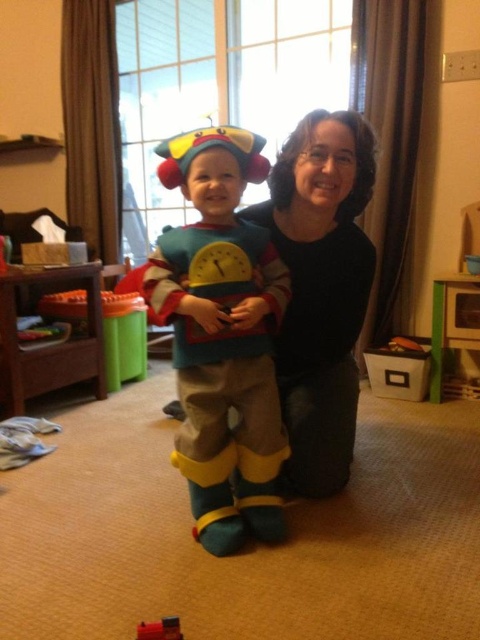
How distant is black fabric at center from metallic red toy at lower left?

The distance of black fabric at center from metallic red toy at lower left is 39.15 inches.

Between black fabric at center and metallic red toy at lower left, which one is positioned lower?

Answer: metallic red toy at lower left is below.

Is point (351, 241) more distant than point (168, 637)?

Yes, point (351, 241) is farther from viewer.

This screenshot has width=480, height=640. What are the coordinates of `black fabric at center` in the screenshot? It's located at (321, 289).

Is point (218, 328) positioned behind point (319, 262)?

No, it is in front of (319, 262).

Is fuzzy yellow costume at center taller than black fabric at center?

No, fuzzy yellow costume at center is not taller than black fabric at center.

Locate an element on the screen. fuzzy yellow costume at center is located at coordinates (222, 337).

Who is shorter, fuzzy yellow costume at center or metallic red toy at lower left?

Standing shorter between the two is metallic red toy at lower left.

Is fuzzy yellow costume at center behind metallic red toy at lower left?

Yes, fuzzy yellow costume at center is further from the viewer.

Between point (222, 205) and point (163, 627), which one is positioned in front?

Positioned in front is point (163, 627).

Identify the location of fuzzy yellow costume at center. (222, 337).